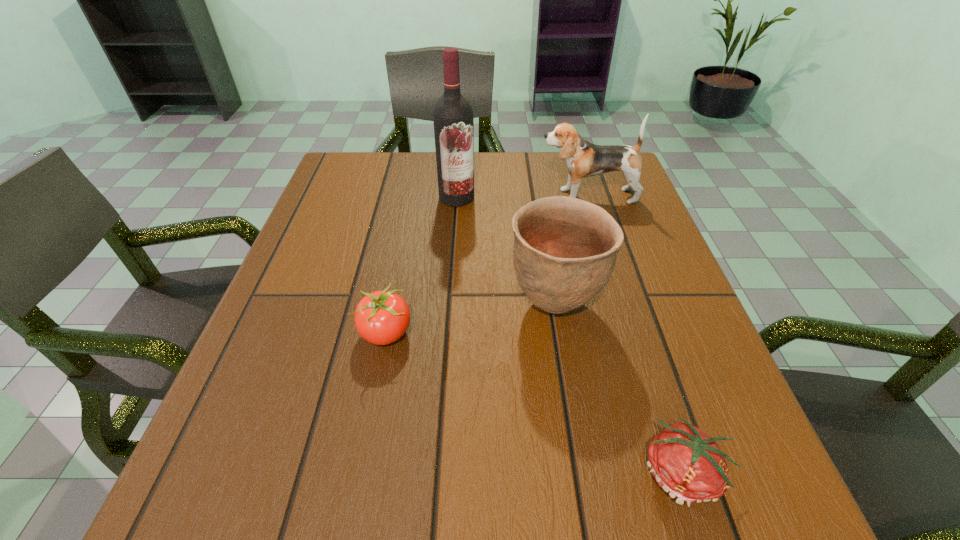
I want to click on object present at the near right corner, so [686, 463].

Identify the location of vacant region at the far edge of the desktop. (480, 171).

The image size is (960, 540). I want to click on free space at the near edge of the desktop, so click(371, 472).

Identify the location of vacant space at the left edge of the desktop. (317, 416).

Where is `vacant space at the right edge of the desktop`? This screenshot has width=960, height=540. vacant space at the right edge of the desktop is located at coordinates point(639,353).

The width and height of the screenshot is (960, 540). In the image, there is a desktop. Identify the location of vacant space at the far left corner. (352, 169).

Find the location of `vacant space at the far right corner`. vacant space at the far right corner is located at coordinates (618, 192).

This screenshot has width=960, height=540. I want to click on vacant position at the near right corner of the desktop, so click(x=707, y=518).

Locate an element on the screen. This screenshot has width=960, height=540. free space between the farther tomato and the nearer tomato is located at coordinates (534, 404).

Locate an element on the screen. This screenshot has height=540, width=960. vacant area between the farther tomato and the puppy is located at coordinates (487, 265).